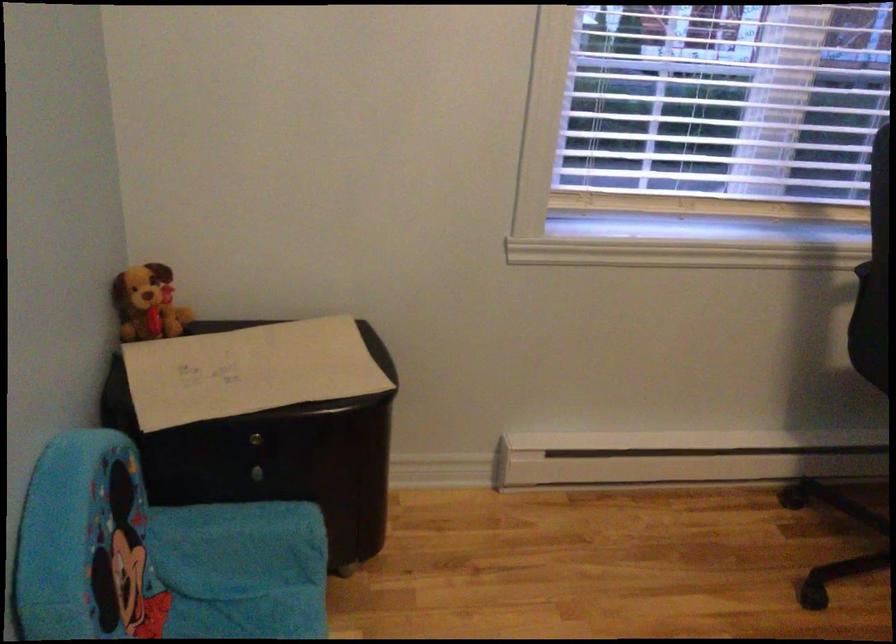
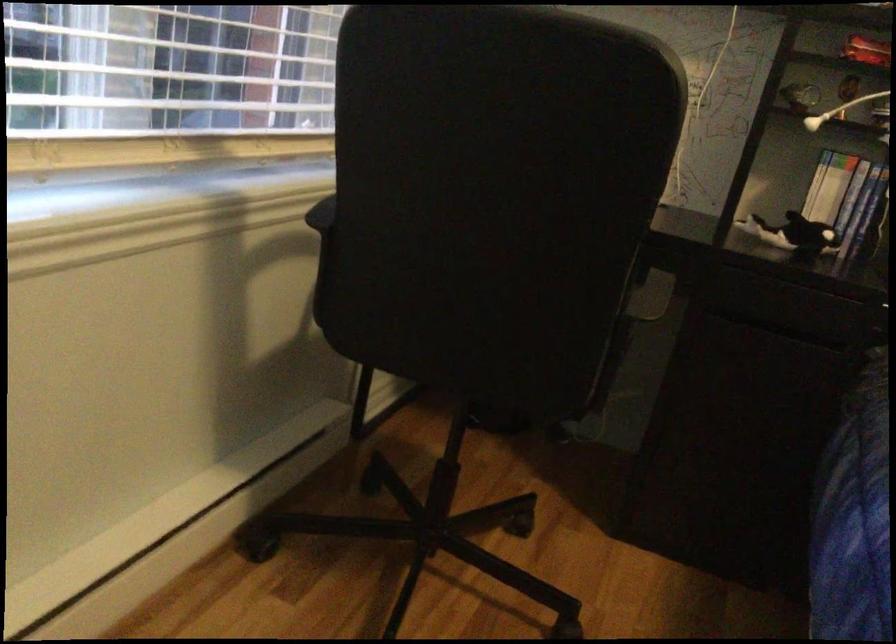
Question: The first image is from the beginning of the video and the second image is from the end. How did the camera likely rotate when shooting the video?

Choices:
 (A) Left
 (B) Right
 (C) Up
 (D) Down

Answer: (B)